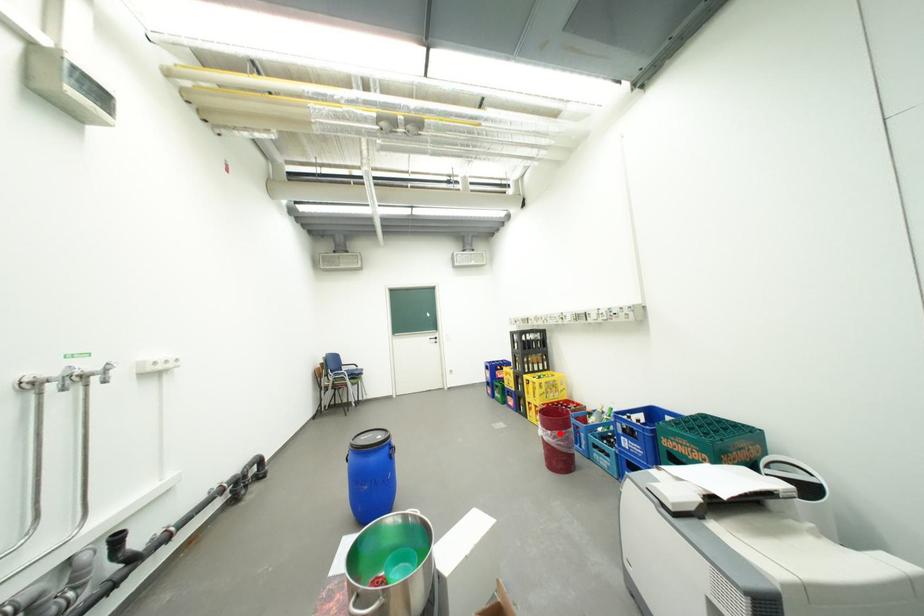
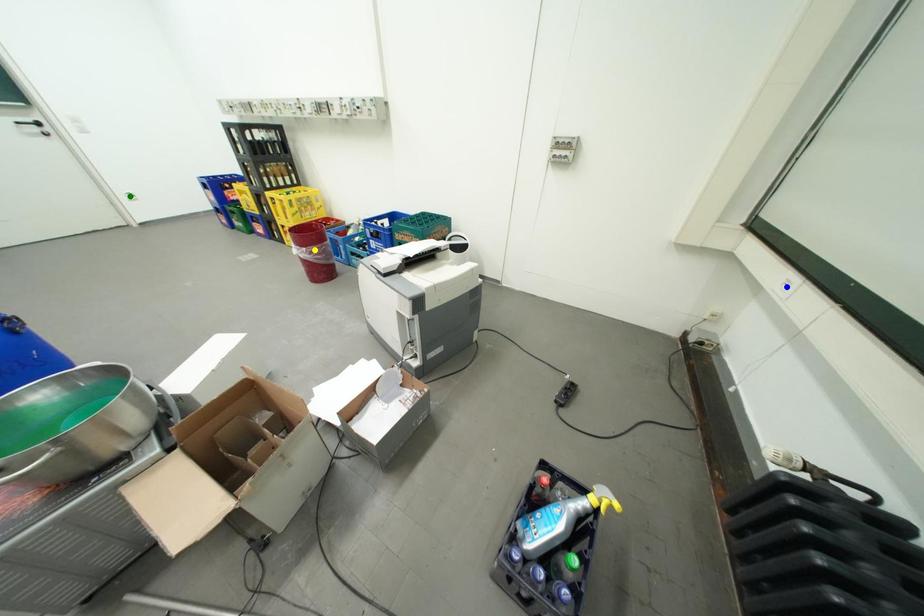
Question: I am providing you with two images of the same scene from different viewpoints. A red point is marked on the first image. You are given multiple points on the second image. Can you choose the point in image 2 that corresponds to the point in image 1?

Choices:
 (A) green point
 (B) blue point
 (C) yellow point

Answer: (C)